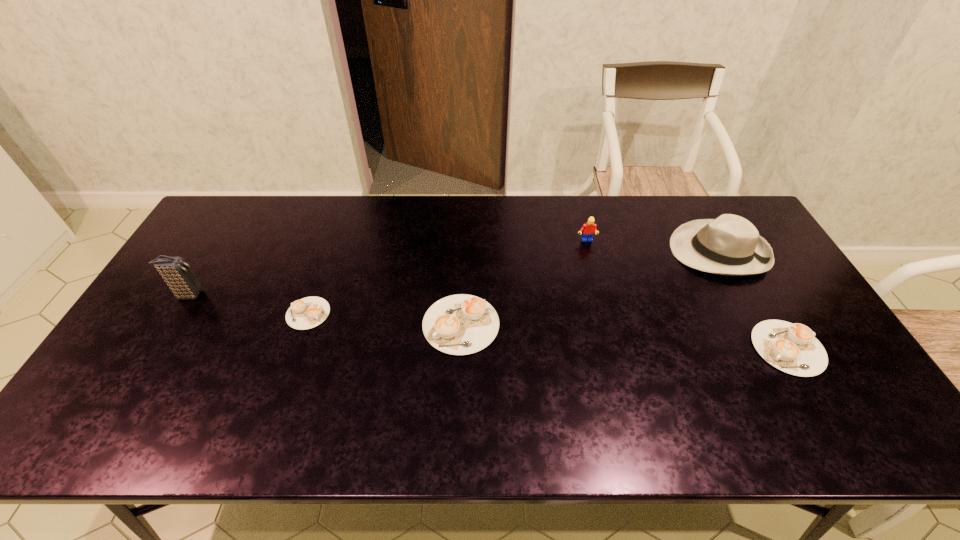
In order to click on vacant space that satisfies the following two spatial constraints: 1. with the zip open on the leftmost cappuccino; 2. on the left side of the clutch bag in this screenshot , I will do `click(177, 313)`.

At what (x,y) coordinates should I click in order to perform the action: click on blank area in the image that satisfies the following two spatial constraints: 1. on the front-facing side of the third tallest object; 2. on the right side of the second shortest object. Please return your answer as a coordinate pair (x, y). Looking at the image, I should click on (612, 348).